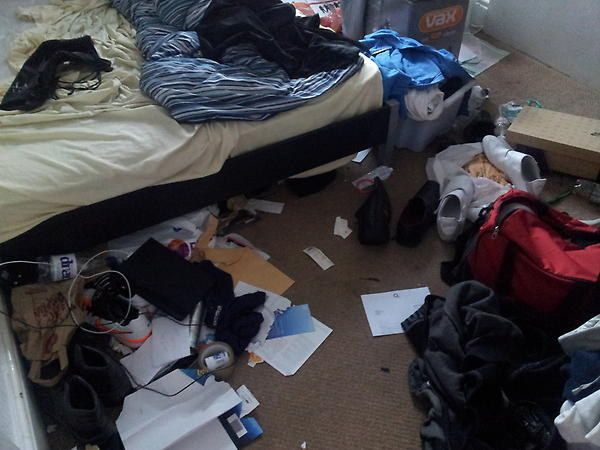
Where is `white cord`? This screenshot has width=600, height=450. white cord is located at coordinates (22, 262).